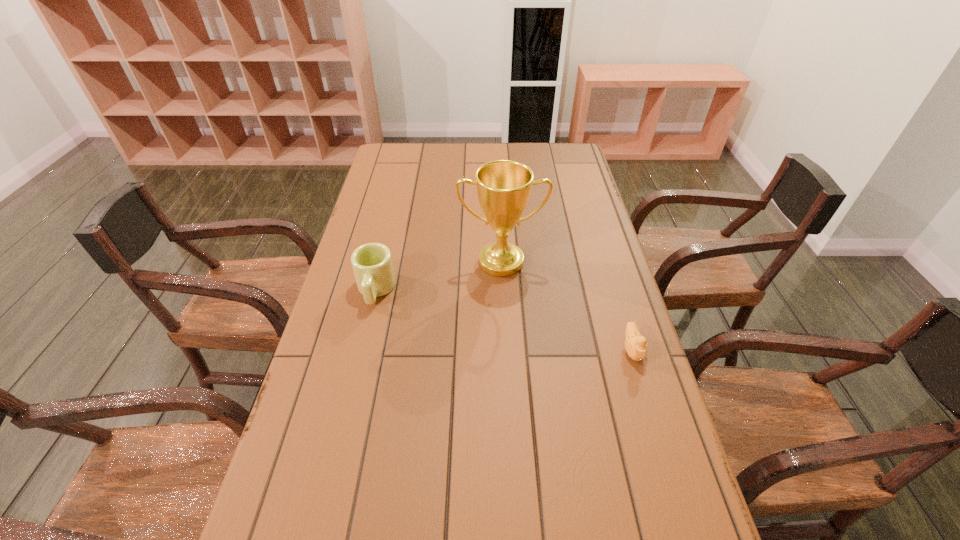
Image resolution: width=960 pixels, height=540 pixels. I want to click on free spot between the award and the leftmost object, so click(438, 276).

Locate which object ranks in proximity to the award. Please provide its 2D coordinates. Your answer should be formatted as a tuple, i.e. [(x, y)], where the tuple contains the x and y coordinates of a point satisfying the conditions above.

[(372, 264)]

At what (x,y) coordinates should I click in order to perform the action: click on object that is the second nearest to the second object from left to right. Please return your answer as a coordinate pair (x, y). The height and width of the screenshot is (540, 960). Looking at the image, I should click on (635, 344).